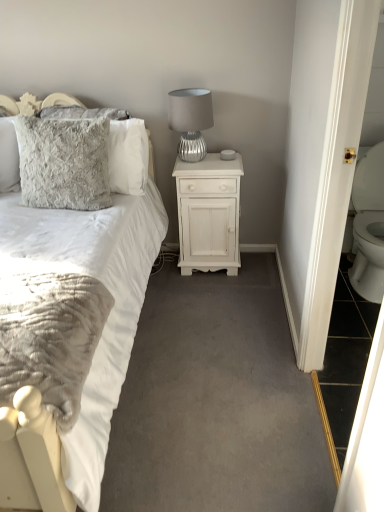
At what (x,y) coordinates should I click in order to perform the action: click on free spot to the right of white painted wood nightstand at center. Please return your answer as a coordinate pair (x, y). Looking at the image, I should click on click(254, 268).